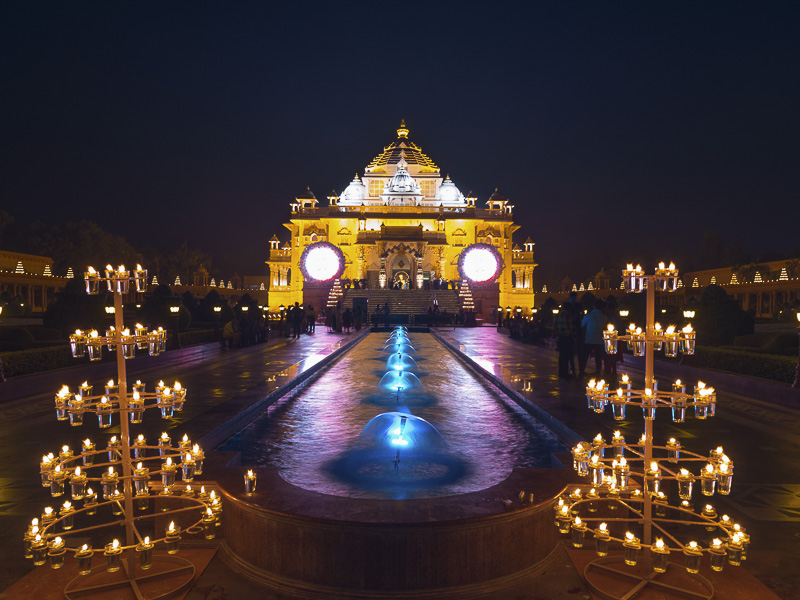
Locate an element on the screen. This screenshot has width=800, height=600. candle tree is located at coordinates (646, 400), (122, 414).